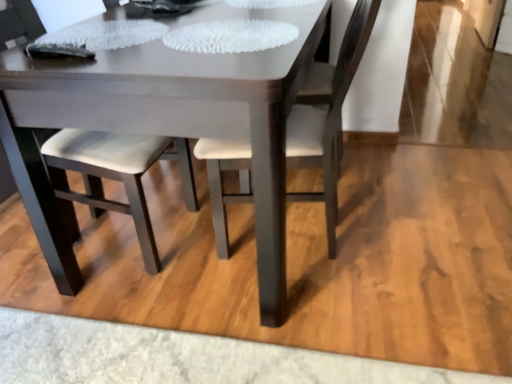
In order to click on vacant space to the right of white leather chair at center, which is the 2th chair in left-to-right order in this screenshot , I will do `click(412, 232)`.